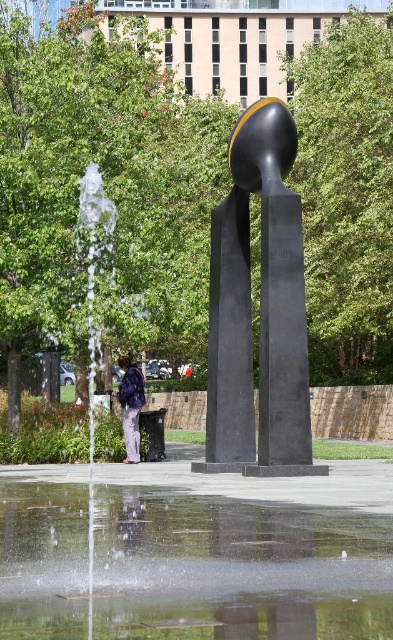
Find the location of a particular element. The height and width of the screenshot is (640, 393). black polished stone sculpture at center is located at coordinates (260, 308).

Is black polished stone sculpture at center to the left of purple fabric backpack at lower left from the viewer's perspective?

In fact, black polished stone sculpture at center is to the right of purple fabric backpack at lower left.

Between point (299, 332) and point (124, 440), which one is positioned in front?

Positioned in front is point (299, 332).

You are a GUI agent. You are given a task and a screenshot of the screen. Output one action in this format:
    pyautogui.click(x=<x>, y=<y>)
    Task: Click on the black polished stone sculpture at center
    This screenshot has width=393, height=640.
    Given the screenshot: What is the action you would take?
    (260, 308)

Does glistening water at fountain center have a lesser width compared to black polished stone sculpture at center?

Incorrect, glistening water at fountain center's width is not less than black polished stone sculpture at center's.

Can you confirm if glistening water at fountain center is bigger than black polished stone sculpture at center?

Yes.

Where is `glistening water at fountain center`? This screenshot has height=640, width=393. glistening water at fountain center is located at coordinates (238, 568).

Is glistening water at fountain center wider than purple fabric backpack at lower left?

Yes, glistening water at fountain center is wider than purple fabric backpack at lower left.

Between glistening water at fountain center and purple fabric backpack at lower left, which one is positioned higher?

purple fabric backpack at lower left is above.

The height and width of the screenshot is (640, 393). What are the coordinates of `glistening water at fountain center` in the screenshot? It's located at (238, 568).